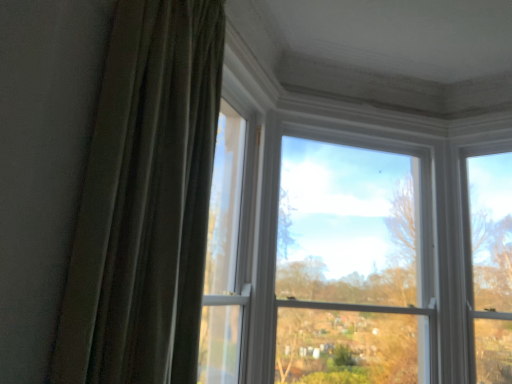
Question: Considering the relative sizes of green velvet curtain at left and clear glass window at center in the image provided, is green velvet curtain at left shorter than clear glass window at center?

Choices:
 (A) no
 (B) yes

Answer: (B)

Question: Is green velvet curtain at left bigger than clear glass window at center?

Choices:
 (A) no
 (B) yes

Answer: (A)

Question: Is green velvet curtain at left turned away from clear glass window at center?

Choices:
 (A) no
 (B) yes

Answer: (A)

Question: Would you say green velvet curtain at left contains clear glass window at center?

Choices:
 (A) yes
 (B) no

Answer: (B)

Question: Is green velvet curtain at left touching clear glass window at center?

Choices:
 (A) no
 (B) yes

Answer: (A)

Question: Does green velvet curtain at left have a lesser width compared to clear glass window at center?

Choices:
 (A) no
 (B) yes

Answer: (A)

Question: Considering the relative positions of clear glass window at center and green velvet curtain at left in the image provided, is clear glass window at center to the right of green velvet curtain at left from the viewer's perspective?

Choices:
 (A) yes
 (B) no

Answer: (A)

Question: From a real-world perspective, is clear glass window at center over green velvet curtain at left?

Choices:
 (A) yes
 (B) no

Answer: (B)

Question: Could you tell me if clear glass window at center is facing green velvet curtain at left?

Choices:
 (A) no
 (B) yes

Answer: (A)

Question: Does clear glass window at center have a smaller size compared to green velvet curtain at left?

Choices:
 (A) no
 (B) yes

Answer: (A)

Question: Can you confirm if clear glass window at center is positioned to the left of green velvet curtain at left?

Choices:
 (A) no
 (B) yes

Answer: (A)

Question: Does clear glass window at center come behind green velvet curtain at left?

Choices:
 (A) yes
 (B) no

Answer: (A)

Question: In the image, is green velvet curtain at left positioned in front of or behind clear glass window at center?

Choices:
 (A) behind
 (B) front

Answer: (B)